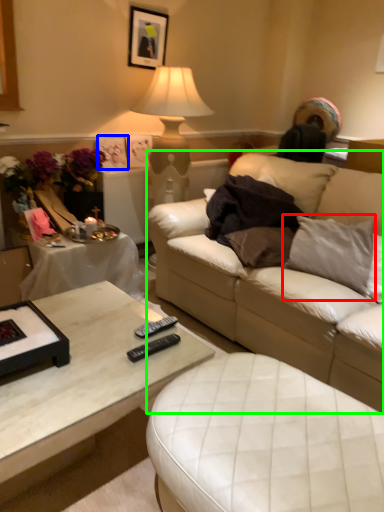
Question: Considering the real-world distances, which object is closest to pillow (highlighted by a red box)? picture frame (highlighted by a blue box) or studio couch (highlighted by a green box).

Choices:
 (A) picture frame
 (B) studio couch

Answer: (B)